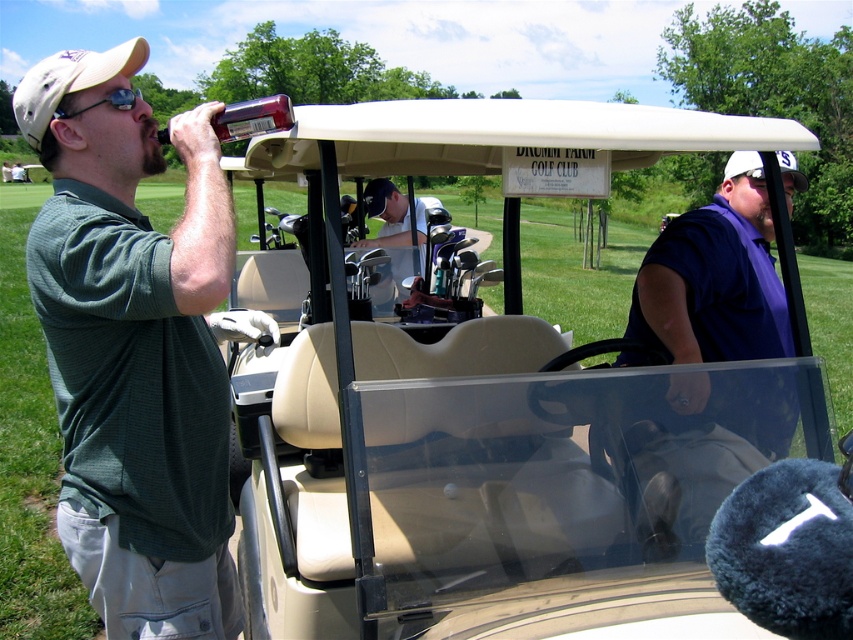
Based on the photo, you are a golfer who just finished a round and needs to retrieve your belongings. You see the purple cotton shirt at center and the translucent plastic bottle at upper left. Can you walk directly between them without needing to move any objects?

The distance between the purple cotton shirt at center and the translucent plastic bottle at upper left is 1.59 meters, so yes, you can walk directly between them since the space is wide enough for a person to pass through comfortably.

You are standing at the point labeled point (788, 424) and want to walk to the point labeled point (389, 214). Which direction should you move in to get closer to your destination?

Since point (788, 424) is closer to the camera than point (389, 214), you should move away from the camera to reach your destination.

You are a golfer who just finished a round and need to find your belongings. You remember seeing a purple cotton shirt at center and a translucent plastic bottle at upper left. Which item is positioned more to the east?

The purple cotton shirt at center is to the right of the translucent plastic bottle at upper left. Since the bottle is at the upper left, the shirt being to its right would place it more to the east.